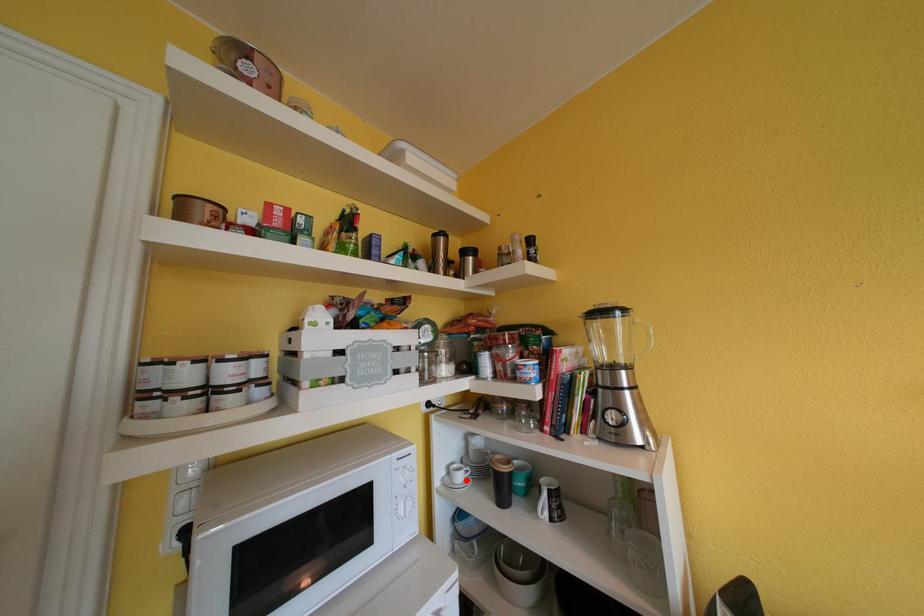
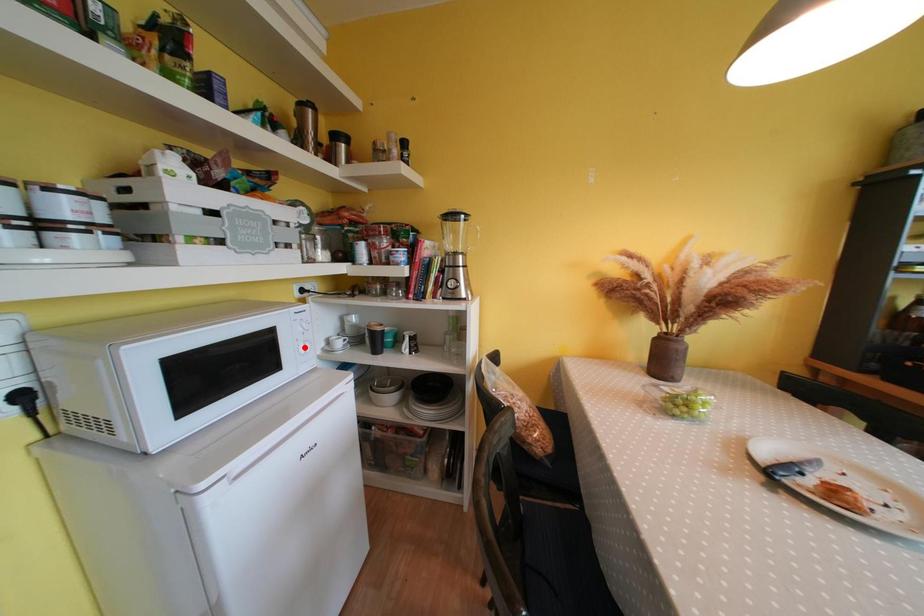
I am providing you with two images of the same scene from different viewpoints. A red point is marked on the first image and another point is marked on the second image. Do the highlighted points in image1 and image2 indicate the same real-world spot?

No